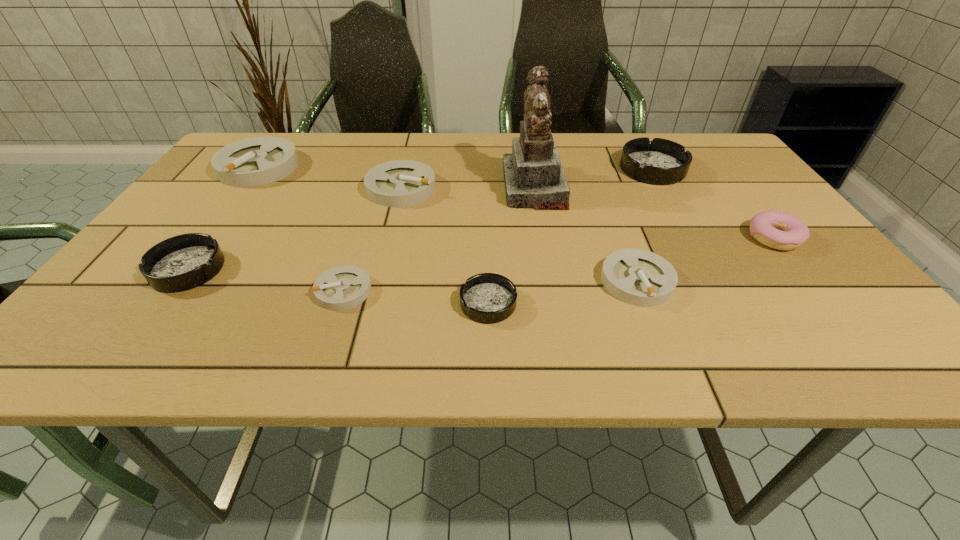
Where is `object that is the closest to the smallest gray ashtray`? object that is the closest to the smallest gray ashtray is located at coordinates (488, 298).

You are a GUI agent. You are given a task and a screenshot of the screen. Output one action in this format:
    pyautogui.click(x=<x>, y=<y>)
    Task: Click on the ashtray that is the sixth nearest to the second dark ashtray from right to left
    The image size is (960, 540).
    Given the screenshot: What is the action you would take?
    pyautogui.click(x=257, y=161)

Image resolution: width=960 pixels, height=540 pixels. I want to click on ashtray that is the fourth nearest to the smallest dark ashtray, so click(x=658, y=162).

Identify the location of gray ashtray that is the fourth closest to the rightmost dark ashtray. The image size is (960, 540). (257, 161).

Where is `gray ashtray that stands as the second closest to the biggest dark ashtray`? The width and height of the screenshot is (960, 540). gray ashtray that stands as the second closest to the biggest dark ashtray is located at coordinates (400, 183).

Locate an element on the screen. The image size is (960, 540). dark ashtray that can be found as the second closest to the farthest dark ashtray is located at coordinates (183, 262).

Identify the location of dark ashtray that is the second closest to the rightmost dark ashtray. (183, 262).

Locate an element on the screen. This screenshot has height=540, width=960. vacant position in the image that satisfies the following two spatial constraints: 1. on the front side of the biggest gray ashtray; 2. on the right side of the rightmost object is located at coordinates (206, 238).

Image resolution: width=960 pixels, height=540 pixels. Find the location of `free spot that satisfies the following two spatial constraints: 1. on the front side of the second dark ashtray from left to right; 2. on the right side of the smallest gray ashtray`. free spot that satisfies the following two spatial constraints: 1. on the front side of the second dark ashtray from left to right; 2. on the right side of the smallest gray ashtray is located at coordinates (340, 303).

Identify the location of vacant space that satisfies the following two spatial constraints: 1. on the front side of the doughnut; 2. on the left side of the farthest dark ashtray. The image size is (960, 540). (692, 238).